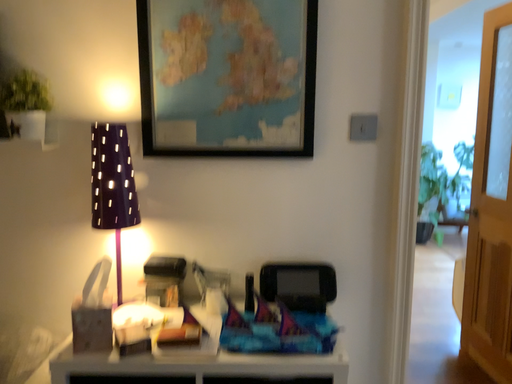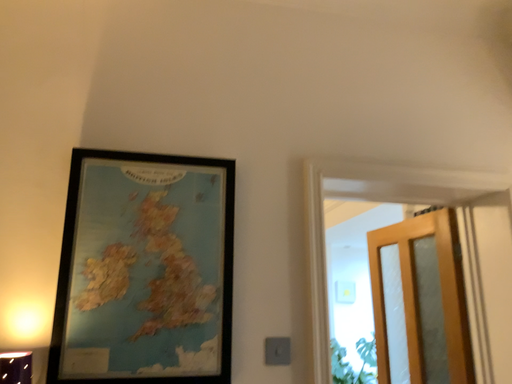
Question: How did the camera likely rotate when shooting the video?

Choices:
 (A) rotated downward
 (B) rotated upward

Answer: (B)